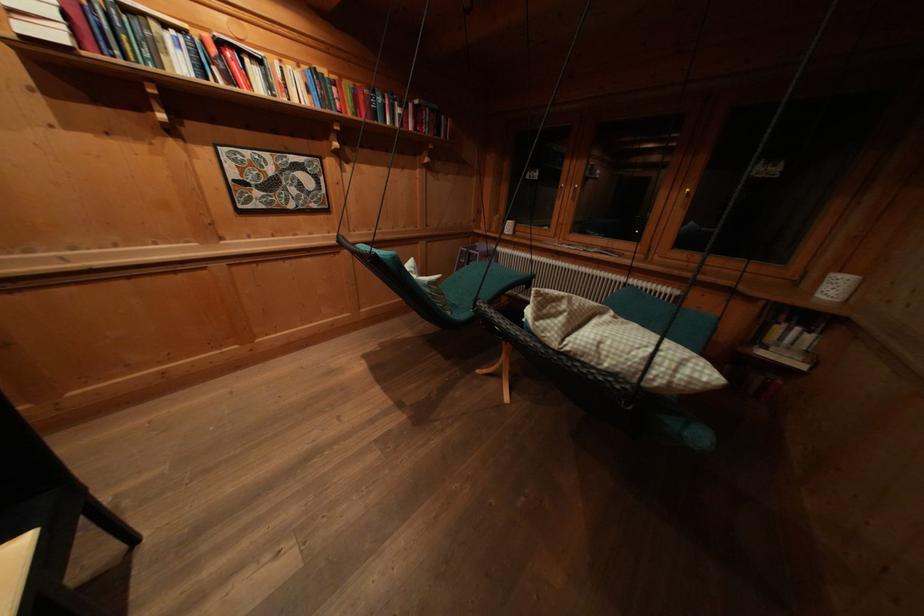
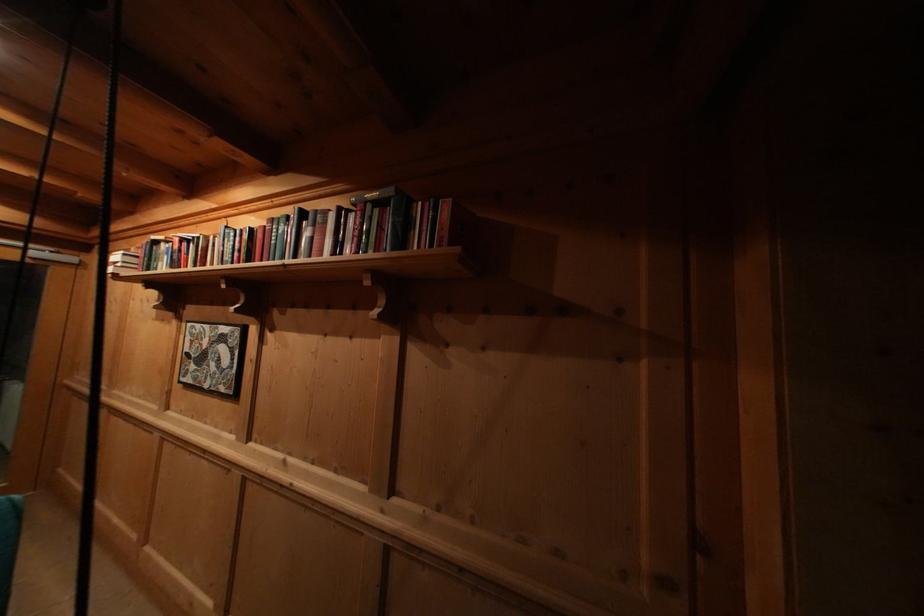
In the second image, find the point that corresponds to point 253,158 in the first image.

(204, 331)